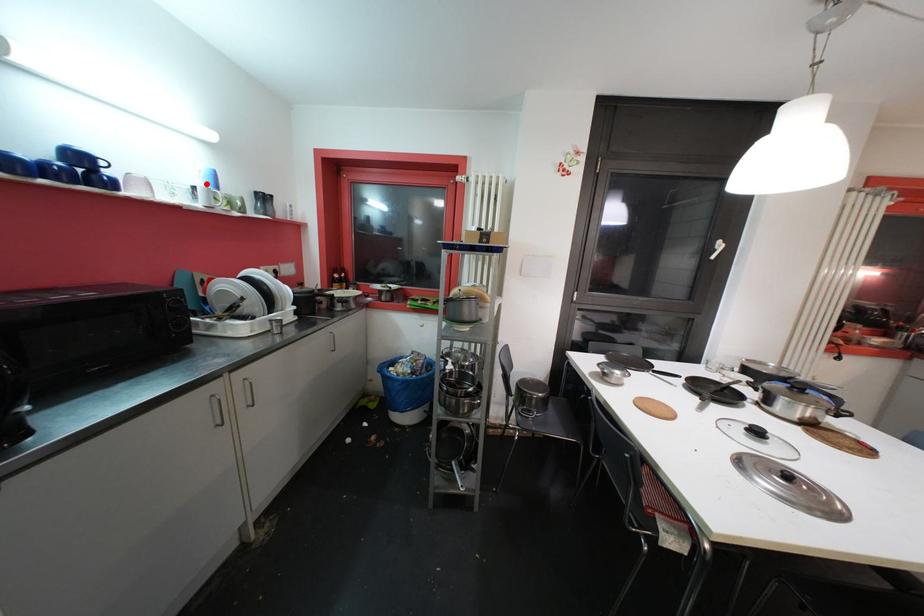
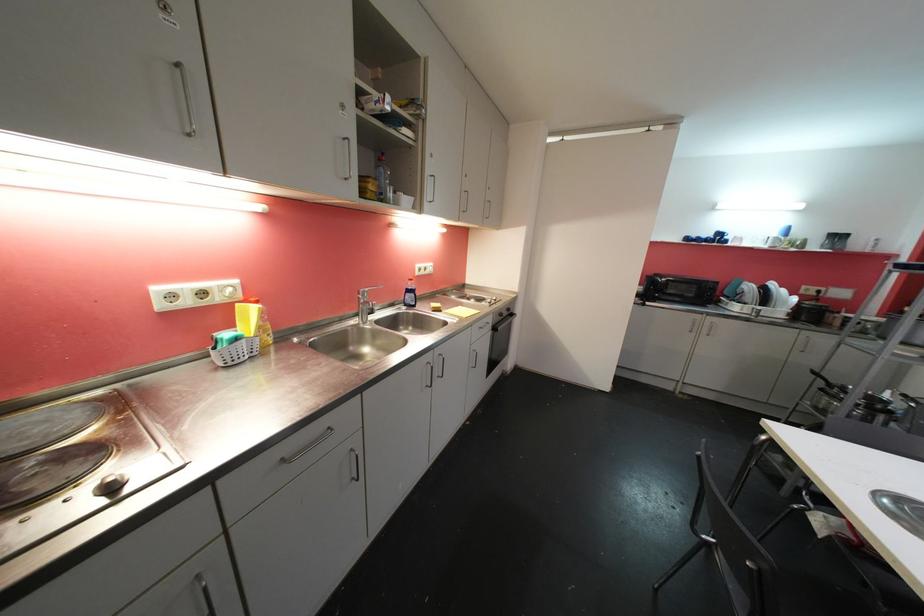
Find the pixel in the second image that matches the highlighted location in the first image.

(781, 236)